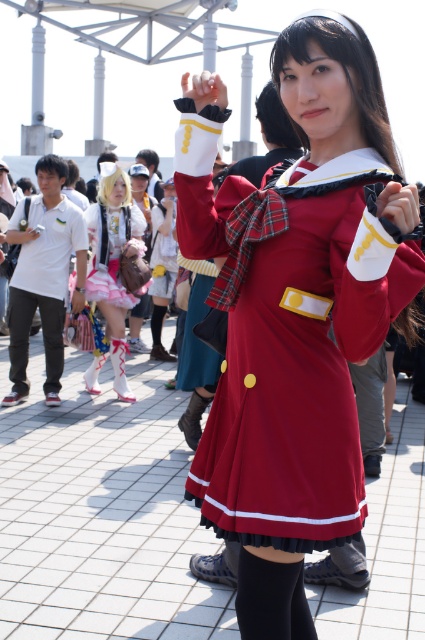
Question: From the image, what is the correct spatial relationship of pastel pink fabric dress at center in relation to black cotton pants at left?

Choices:
 (A) right
 (B) left

Answer: (A)

Question: Which object appears farthest from the camera in this image?

Choices:
 (A) black cotton pants at left
 (B) matte red dress at center
 (C) pastel pink fabric dress at center
 (D) white matte shirt at left

Answer: (C)

Question: Which object appears farthest from the camera in this image?

Choices:
 (A) white matte shirt at left
 (B) black cotton pants at left

Answer: (A)

Question: Does matte red dress at center have a larger size compared to black cotton pants at left?

Choices:
 (A) yes
 (B) no

Answer: (A)

Question: Is white matte shirt at left thinner than pastel pink tulle dress at center?

Choices:
 (A) yes
 (B) no

Answer: (B)

Question: Which of the following is the closest to the observer?

Choices:
 (A) (93, 252)
 (B) (23, 380)

Answer: (B)